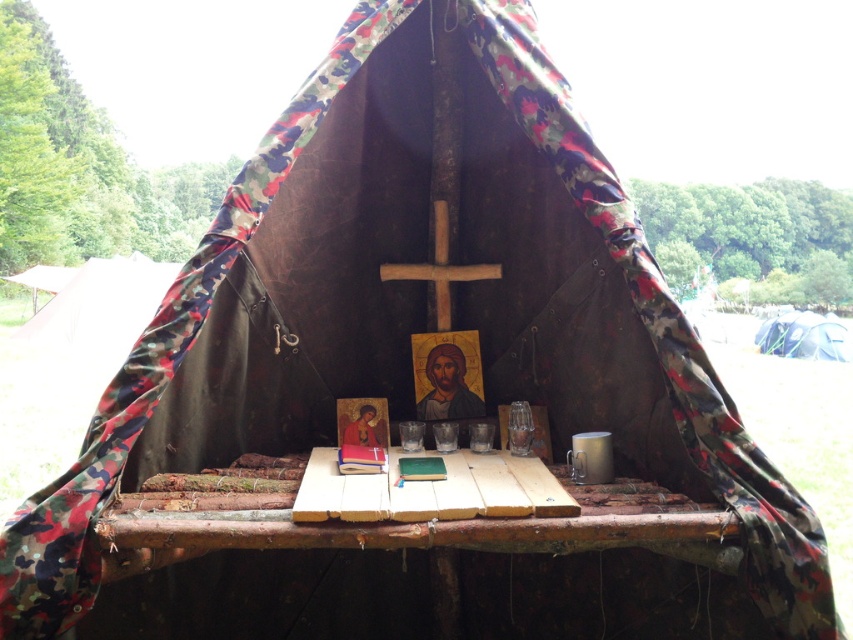
Question: Is wooden picnic table at center bigger than white canvas tent at right?

Choices:
 (A) no
 (B) yes

Answer: (A)

Question: Which object appears closest to the camera in this image?

Choices:
 (A) camo fabric tent at left
 (B) wooden picnic table at center

Answer: (B)

Question: Does wooden picnic table at center have a larger size compared to white canvas tent at right?

Choices:
 (A) no
 (B) yes

Answer: (A)

Question: Does camo fabric tent at left appear on the right side of white canvas tent at right?

Choices:
 (A) yes
 (B) no

Answer: (B)

Question: Which point is closer to the camera taking this photo?

Choices:
 (A) (607, 536)
 (B) (131, 312)
 (C) (787, 316)

Answer: (A)

Question: Which of the following is the closest to the observer?

Choices:
 (A) (817, 316)
 (B) (181, 497)
 (C) (120, 348)

Answer: (B)